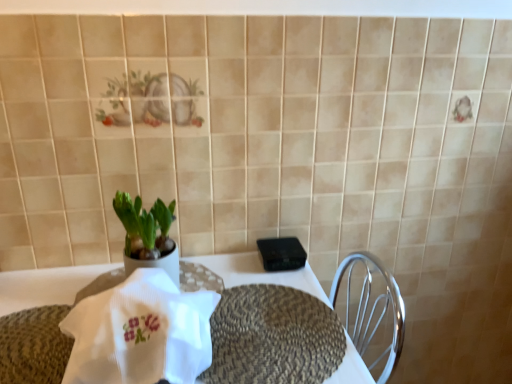
I want to click on vacant area located to the right-hand side of green matte plant at center, so click(x=220, y=275).